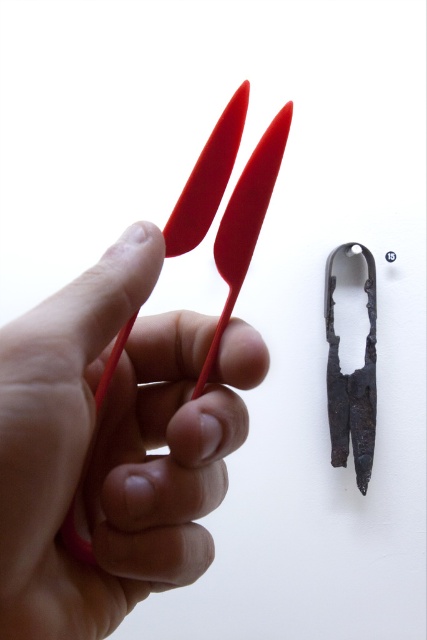
You are an archaeologist examining two matte plastic scissors at center and matte plastic scissors at left in your hand. You need to determine which one is wider. Based on the description, which scissors are wider?

The matte plastic scissors at center are wider than the matte plastic scissors at left.

What object is located at the coordinates point [111,445] in the image?

The point [111,445] corresponds to the matte plastic scissors at center.